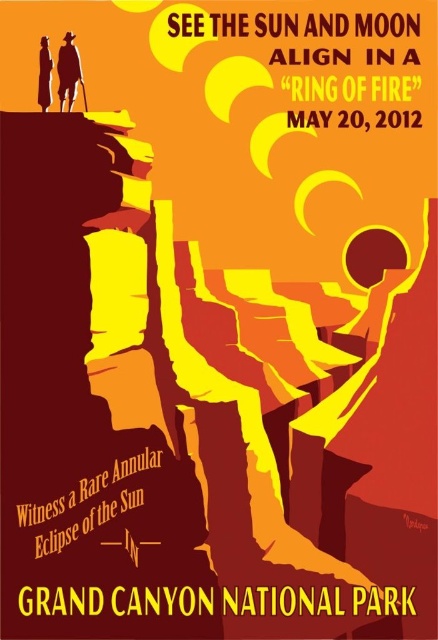
Question: Is matte brown hat at upper left above matte black figure at upper left?

Choices:
 (A) no
 (B) yes

Answer: (B)

Question: Can you confirm if matte brown hat at upper left is wider than matte black figure at upper left?

Choices:
 (A) yes
 (B) no

Answer: (B)

Question: Which object appears closest to the camera in this image?

Choices:
 (A) matte brown hat at upper left
 (B) matte black figure at upper left

Answer: (A)

Question: Among these objects, which one is nearest to the camera?

Choices:
 (A) matte black figure at upper left
 (B) matte brown hat at upper left

Answer: (B)

Question: Which point is farther to the camera?

Choices:
 (A) (71, 72)
 (B) (49, 100)

Answer: (B)

Question: Is the position of matte brown hat at upper left more distant than that of matte black figure at upper left?

Choices:
 (A) no
 (B) yes

Answer: (A)